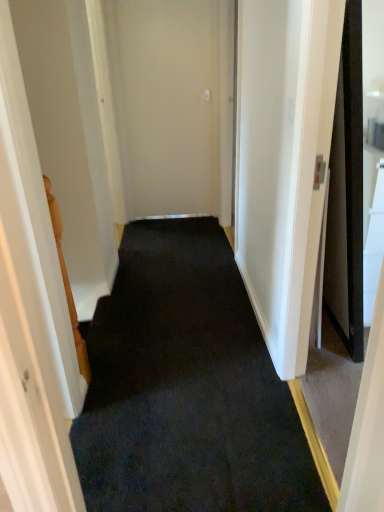
Measure the distance between black carpet at center and camera.

The depth of black carpet at center is 4.95 feet.

What are the coordinates of `black carpet at center` in the screenshot? It's located at (186, 387).

This screenshot has width=384, height=512. What do you see at coordinates (186, 387) in the screenshot? I see `black carpet at center` at bounding box center [186, 387].

Measure the distance between point (133, 128) and camera.

Point (133, 128) is 3.80 meters from camera.

The image size is (384, 512). What do you see at coordinates (173, 104) in the screenshot?
I see `beige matte door at center` at bounding box center [173, 104].

Image resolution: width=384 pixels, height=512 pixels. I want to click on beige matte door at center, so click(173, 104).

The image size is (384, 512). I want to click on black carpet at center, so click(x=186, y=387).

Considering the positions of objects beige matte door at center and black carpet at center in the image provided, who is more to the left, beige matte door at center or black carpet at center?

beige matte door at center.

In the scene shown: Is beige matte door at center further to the viewer compared to black carpet at center?

Yes, beige matte door at center is behind black carpet at center.

Is point (195, 33) closer or farther from the camera than point (158, 481)?

Point (195, 33) is farther from the camera than point (158, 481).

From the image's perspective, is beige matte door at center over black carpet at center?

Correct, beige matte door at center appears higher than black carpet at center in the image.

From a real-world perspective, who is located higher, beige matte door at center or black carpet at center?

In real-world perspective, beige matte door at center is above.

Does beige matte door at center have a greater width compared to black carpet at center?

Incorrect, the width of beige matte door at center does not surpass that of black carpet at center.

Who is shorter, beige matte door at center or black carpet at center?

black carpet at center.

Considering the relative sizes of beige matte door at center and black carpet at center in the image provided, is beige matte door at center smaller than black carpet at center?

Indeed, beige matte door at center has a smaller size compared to black carpet at center.

Would you say beige matte door at center is inside or outside black carpet at center?

beige matte door at center cannot be found inside black carpet at center.

Is beige matte door at center touching black carpet at center?

→ beige matte door at center and black carpet at center are clearly separated.

Is beige matte door at center oriented towards black carpet at center?

Yes, beige matte door at center is facing black carpet at center.

You are a GUI agent. You are given a task and a screenshot of the screen. Output one action in this format:
    pyautogui.click(x=<x>, y=<y>)
    Task: Click on the door above the black carpet at center (from a real-world perspective)
    This screenshot has height=512, width=384.
    Given the screenshot: What is the action you would take?
    pyautogui.click(x=173, y=104)

Which is more to the right, black carpet at center or beige matte door at center?

Positioned to the right is black carpet at center.

In the image, is black carpet at center positioned in front of or behind beige matte door at center?

Visually, black carpet at center is located in front of beige matte door at center.

Which is more distant, (174, 360) or (185, 109)?

The point (185, 109) is farther.

Based on the photo, from the image's perspective, is black carpet at center located above or below beige matte door at center?

black carpet at center is below beige matte door at center.

From a real-world perspective, is black carpet at center located higher than beige matte door at center?

No, from a real-world perspective, black carpet at center is not on top of beige matte door at center.

Considering the relative sizes of black carpet at center and beige matte door at center in the image provided, is black carpet at center thinner than beige matte door at center?

No.

From their relative heights in the image, would you say black carpet at center is taller or shorter than beige matte door at center?

Clearly, black carpet at center is shorter compared to beige matte door at center.

Based on their sizes in the image, would you say black carpet at center is bigger or smaller than beige matte door at center?

black carpet at center is bigger than beige matte door at center.

Can we say black carpet at center lies outside beige matte door at center?

Yes, black carpet at center is located beyond the bounds of beige matte door at center.

Is black carpet at center directly adjacent to beige matte door at center?

No.

Is beige matte door at center at the back of black carpet at center?

Yes, black carpet at center is positioned with its back facing beige matte door at center.

How many degrees apart are the facing directions of black carpet at center and beige matte door at center?

0.000746 degrees separate the facing orientations of black carpet at center and beige matte door at center.

Where is `doormat below the beige matte door at center (from a real-world perspective)`? The height and width of the screenshot is (512, 384). doormat below the beige matte door at center (from a real-world perspective) is located at coordinates (186, 387).

In the image, there is a beige matte door at center. Identify the location of doormat below it (from the image's perspective). The image size is (384, 512). (186, 387).

Where is `door to the left of black carpet at center`? This screenshot has width=384, height=512. door to the left of black carpet at center is located at coordinates (173, 104).